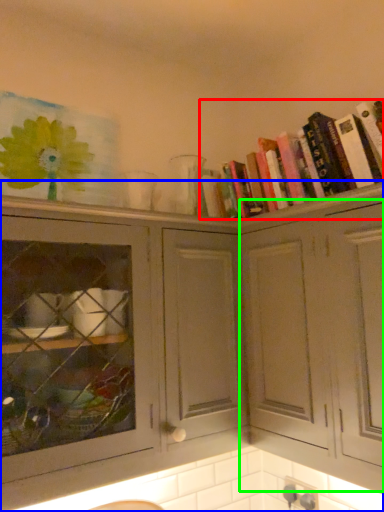
Question: Which object is positioned farthest from book (highlighted by a red box)? Select from cabinetry (highlighted by a blue box) and cabinetry (highlighted by a green box).

Choices:
 (A) cabinetry
 (B) cabinetry

Answer: (A)